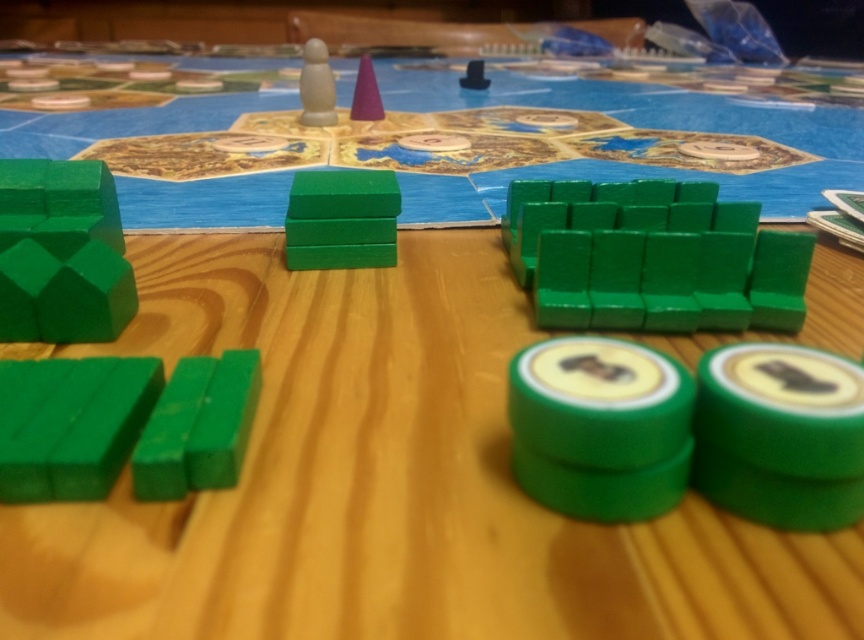
What are the coordinates of the green matte blocks at center right in the image?

The green matte blocks at center right are located at coordinates point (651, 257).